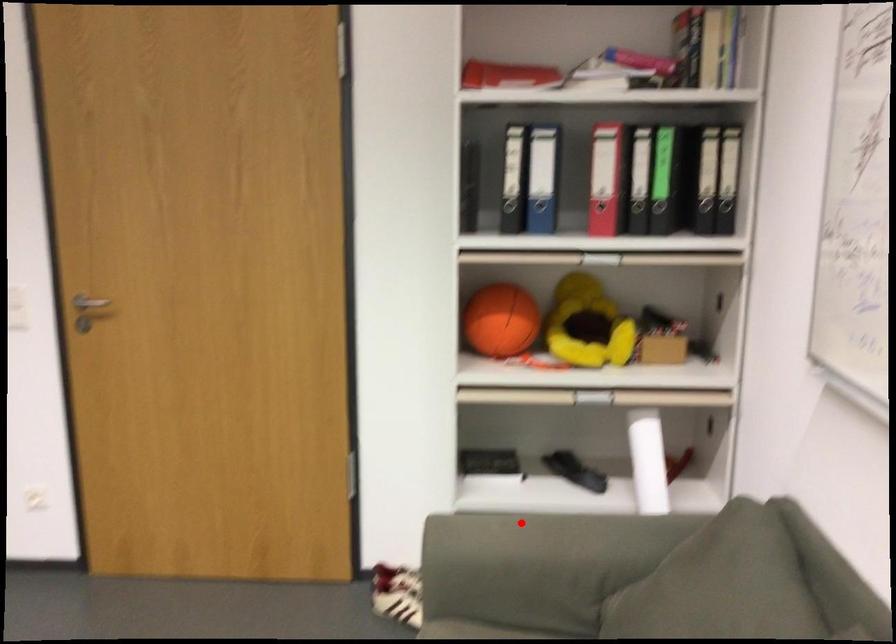
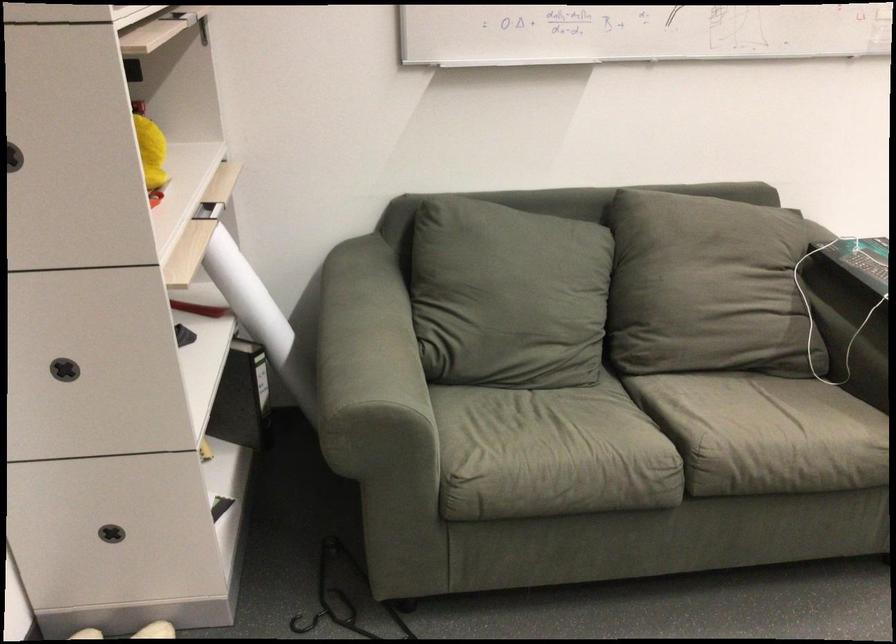
Question: A red point is marked in image1. In image2, is the corresponding 3D point closer to the camera or farther? Reply with the corresponding letter.

Choices:
 (A) The corresponding 3D point is closer.
 (B) The corresponding 3D point is farther.

Answer: (A)